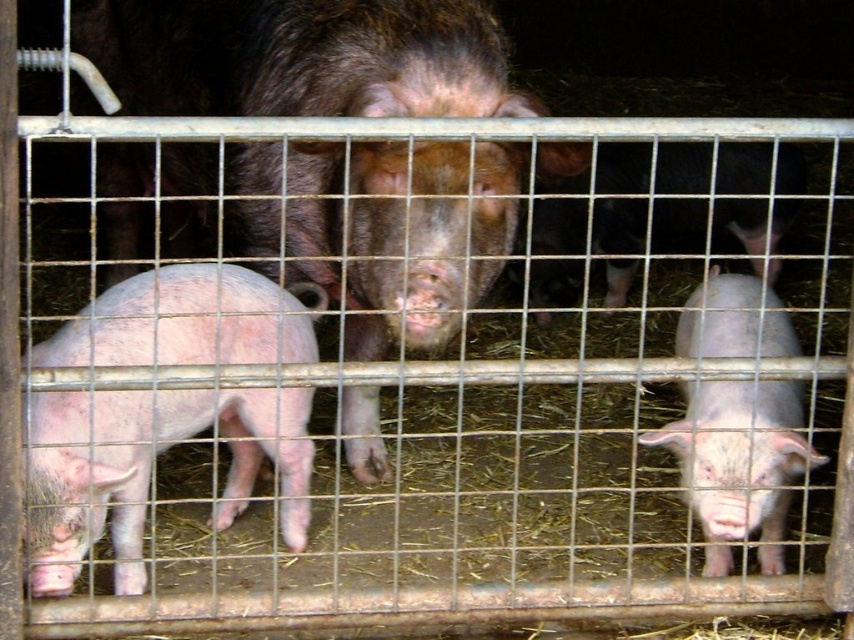
You are a farmer checking the pigs in the enclosure. You notice the brown matte pig at center and the pink smooth piglet at right. Which one is taller?

The brown matte pig at center is much taller than the pink smooth piglet at right.

You are a farmer checking the pigs in the pen. You need to move the brown matte pig at center to the feeding area, which is 12 inches away from its current position. Can you move it directly to the feeding area without moving the pink smooth pig at left?

The distance between the brown matte pig at center and the pink smooth pig at left is 11.98 inches. Since the required distance to the feeding area is 12 inches, the brown matte pig at center can be moved directly to the feeding area without disturbing the pink smooth pig at left as the required distance is just slightly more than the existing gap.